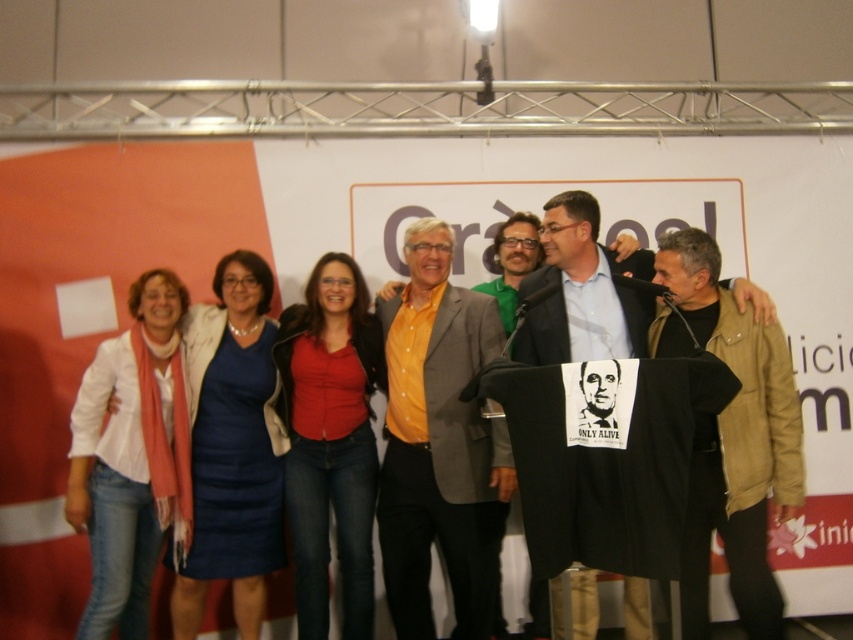
You are a photographer setting up for a group photo. You need to ensure that all clothing items in the scene are visible. The brown leather jacket at right and the matte red shirt at center are two key items. Based on their positions and sizes, which clothing item might require more space to avoid being cropped out of the photo?

The brown leather jacket at right might be wider than the matte red shirt at center, so it might require more space to avoid being cropped out of the photo.

You are organizing a photo shoot and want to ensure proper lighting for the subjects. Given the positioning of the yellow cotton shirt at center and the blue dress at center, which one should you adjust the lighting towards if you want to highlight the leftmost person in the group?

The blue dress at center should be adjusted for lighting since the yellow cotton shirt at center is positioned on the right side of the blue dress at center, making the blue dress the leftmost between the two.

You are organizing a charity event and need to ensure all participants can fit into a group photo. You have two outfits to choose from for the photographer to wear. The first is the brown leather jacket at right, and the second is the matte red shirt at center. If the photographer must wear the smaller outfit to blend in with the group, which one should they choose?

The matte red shirt at center is smaller in size than the brown leather jacket at right, so the photographer should choose the matte red shirt at center to blend in with the group.